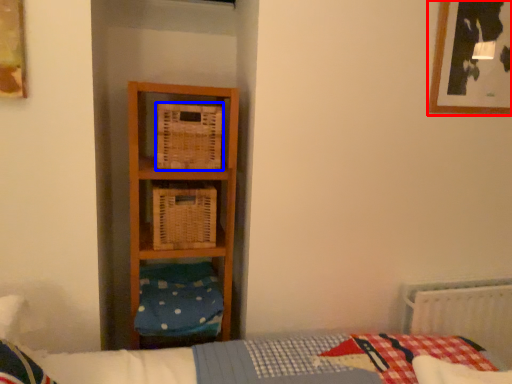
Question: Which of the following is the farthest to the observer, picture frame (highlighted by a red box) or crate (highlighted by a blue box)?

Choices:
 (A) picture frame
 (B) crate

Answer: (A)